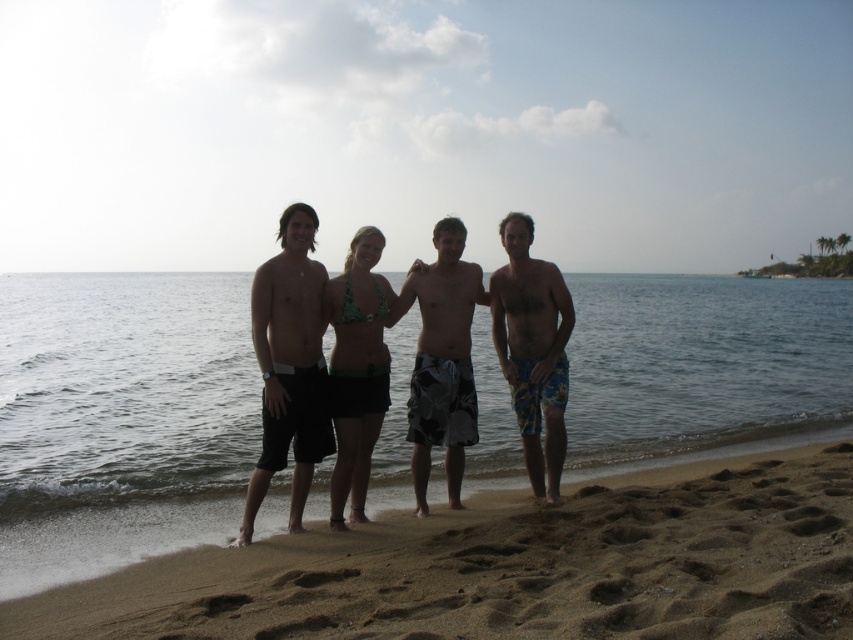
Question: Can you confirm if camouflage-patterned shorts at center is smaller than floral swim trunks at right?

Choices:
 (A) no
 (B) yes

Answer: (B)

Question: Estimate the real-world distances between objects in this image. Which object is farther from the clear blue water at center?

Choices:
 (A) green bikini top at center
 (B) black matte shorts at center
 (C) camouflage-patterned shorts at center
 (D) floral swim trunks at right

Answer: (C)

Question: Does brown sandy beach at lower center have a greater width compared to green bikini top at center?

Choices:
 (A) no
 (B) yes

Answer: (B)

Question: Which object is closer to the camera taking this photo?

Choices:
 (A) clear blue water at center
 (B) floral swim trunks at right
 (C) green bikini top at center

Answer: (C)

Question: Considering the relative positions of clear blue water at center and floral swim trunks at right in the image provided, where is clear blue water at center located with respect to floral swim trunks at right?

Choices:
 (A) left
 (B) right

Answer: (B)

Question: Which is farther from the green bikini top at center?

Choices:
 (A) floral swim trunks at right
 (B) camouflage-patterned shorts at center
 (C) brown sandy beach at lower center
 (D) clear blue water at center

Answer: (D)